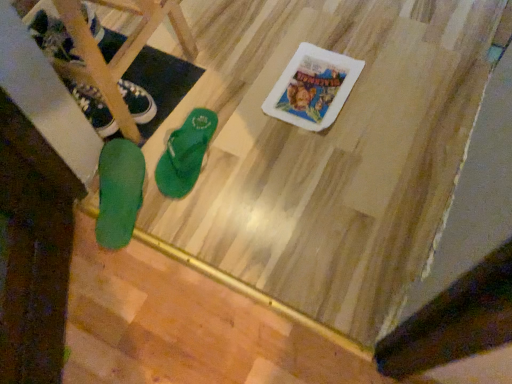
At what (x,y) coordinates should I click in order to perform the action: click on free space to the right of green rubber flip-flop at lower left, the 3th footwear when ordered from right to left. Please return your answer as a coordinate pair (x, y). Looking at the image, I should click on (175, 85).